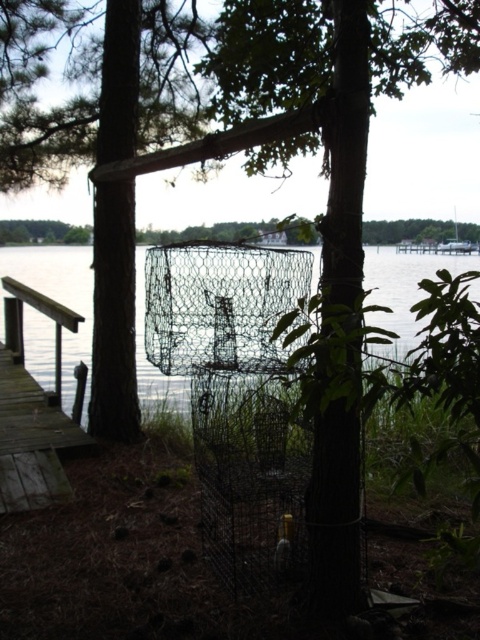
You are a fisherman who wants to walk from the wooden dock at left to the wire mesh net at center to check it. Can you safely walk between them without any obstacles?

The wire mesh net at center and wooden dock at left are 1.70 meters apart from each other, so yes, you can safely walk between them as the distance is manageable for a person to step across.

You are a fisherman checking your crab traps. You see the wire mesh net at center and the metallic wire basket at center. Which one is positioned higher?

The wire mesh net at center is above the metallic wire basket at center, so the wire mesh net at center is positioned higher.